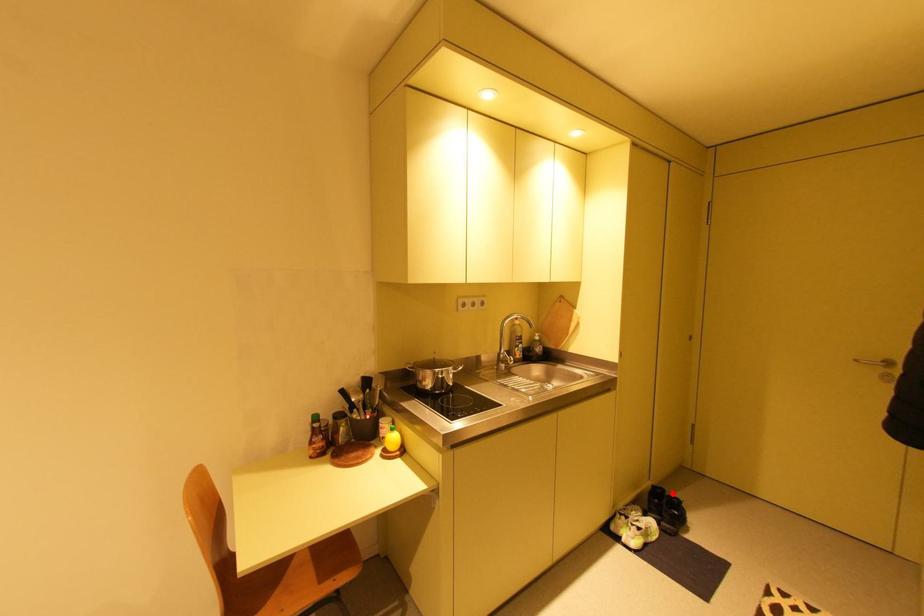
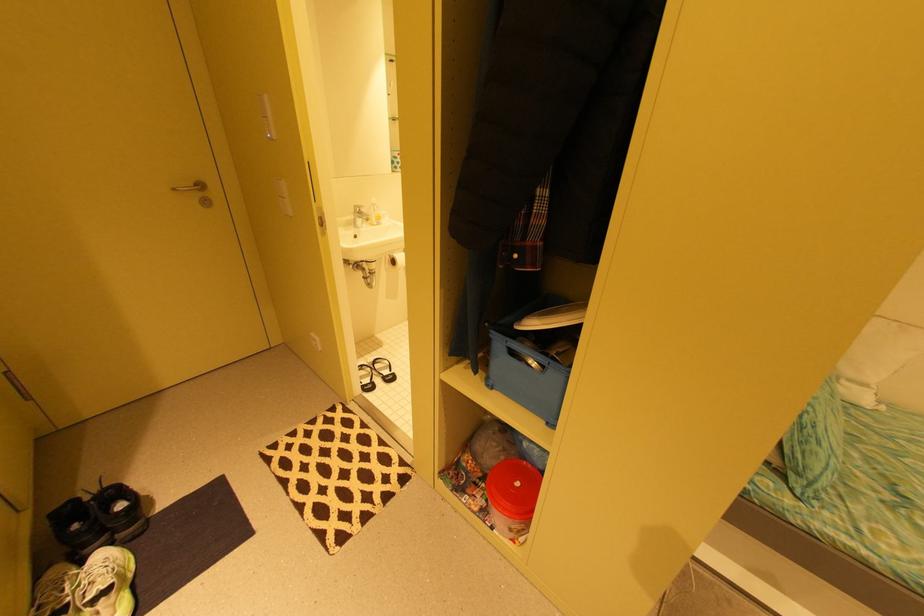
Question: A red point is marked in image1. In image2, is the corresponding 3D point closer to the camera or farther? Reply with the corresponding letter.

Choices:
 (A) The corresponding 3D point is closer.
 (B) The corresponding 3D point is farther.

Answer: (A)